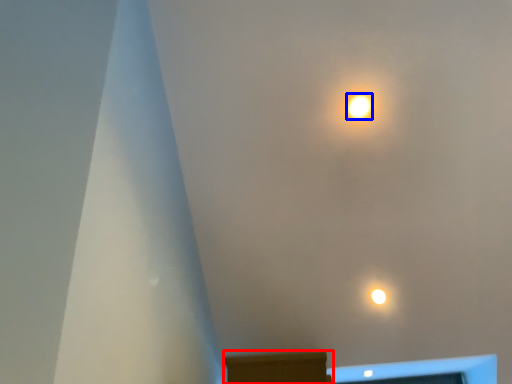
Question: Which point is closer to the camera, furniture (highlighted by a red box) or lamp (highlighted by a blue box)?

Choices:
 (A) furniture
 (B) lamp

Answer: (A)